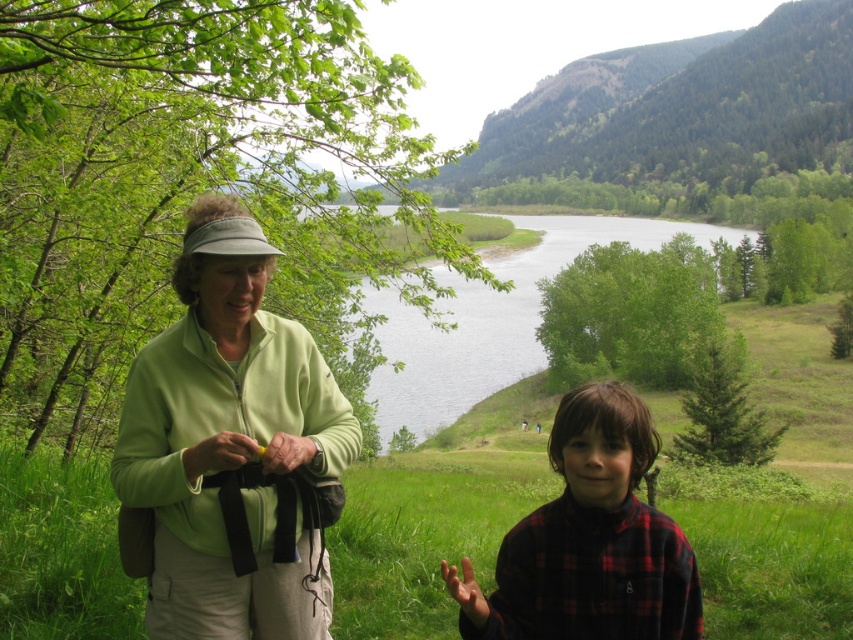
Question: Estimate the real-world distances between objects in this image. Which object is closer to the green matte jacket at upper left?

Choices:
 (A) plaid flannel shirt at lower right
 (B) green grassy lake at center

Answer: (A)

Question: Is green matte jacket at upper left above green grassy lake at center?

Choices:
 (A) no
 (B) yes

Answer: (A)

Question: Which of the following is the closest to the observer?

Choices:
 (A) (209, 576)
 (B) (590, 227)
 (C) (515, 602)

Answer: (A)

Question: Is green matte jacket at upper left wider than plaid flannel shirt at lower right?

Choices:
 (A) yes
 (B) no

Answer: (B)

Question: Does green matte jacket at upper left have a smaller size compared to plaid flannel shirt at lower right?

Choices:
 (A) yes
 (B) no

Answer: (A)

Question: Which point is farther to the camera?

Choices:
 (A) green grassy lake at center
 (B) plaid flannel shirt at lower right

Answer: (A)